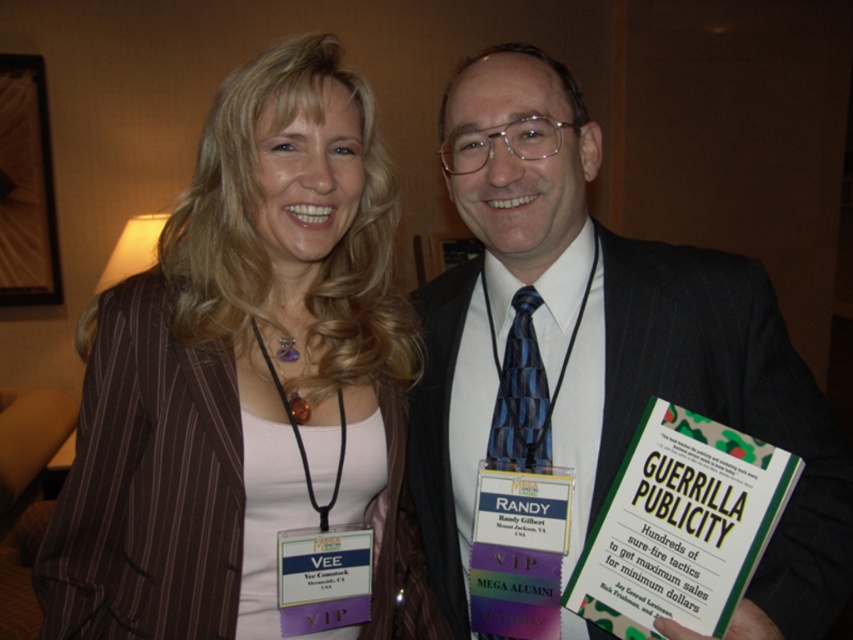
You are a photographer at a networking event. You need to adjust the lighting so that both the brown pinstriped blazer at upper left and the dark suit at center are evenly illuminated. Based on their positions, which side should you increase the light intensity on?

The brown pinstriped blazer at upper left is to the left of the dark suit at center, so you should increase the light intensity on the left side to ensure both are evenly illuminated.

You are organizing a photo album and need to categorize this image based on clothing details. Which clothing item, the brown pinstriped blazer at upper left or the dark suit at center, is shorter in height?

The brown pinstriped blazer at upper left has a lesser height compared to the dark suit at center, so the brown pinstriped blazer at upper left is shorter in height.

You are a photographer adjusting the camera settings for a group photo. The two subjects are wearing the brown pinstriped blazer at upper left and the dark suit at center. The minimum focus distance of your camera is 9 inches. Can you focus on both subjects without moving the camera?

The brown pinstriped blazer at upper left is 9.44 inches from the dark suit at center. Since the distance between them is greater than the camera minimum focus distance of 9 inches, the camera can focus on both subjects without moving.